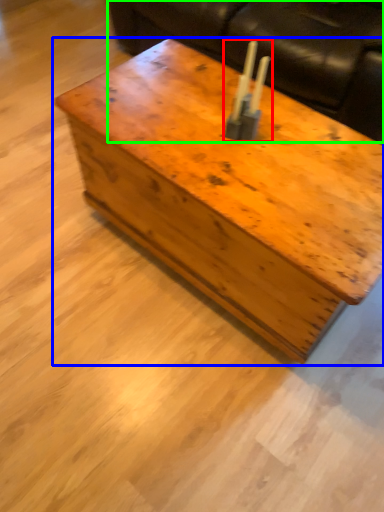
Question: Based on their relative distances, which object is nearer to candle holder (highlighted by a red box)? Choose from table (highlighted by a blue box) and couch (highlighted by a green box).

Choices:
 (A) table
 (B) couch

Answer: (A)